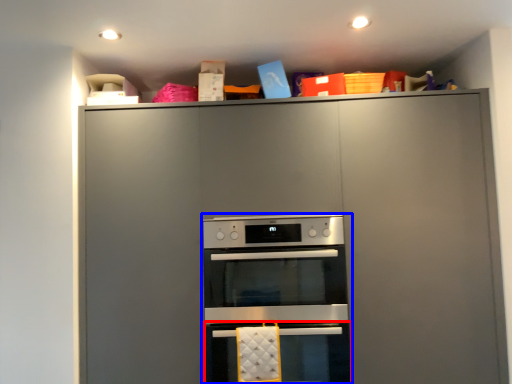
Question: Which object appears closest to the camera in this image, oven (highlighted by a red box) or oven (highlighted by a blue box)?

Choices:
 (A) oven
 (B) oven

Answer: (A)